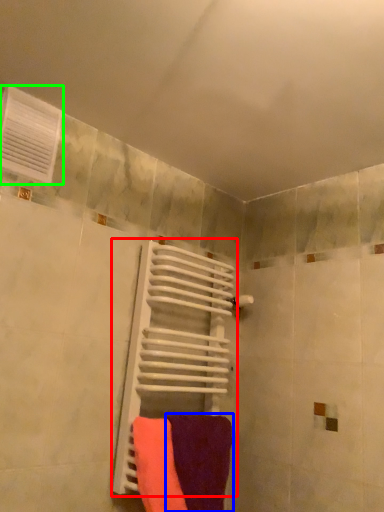
Question: Estimate the real-world distances between objects in this image. Which object is closer to radiator (highlighted by a red box), towel (highlighted by a blue box) or air conditioning (highlighted by a green box)?

Choices:
 (A) towel
 (B) air conditioning

Answer: (A)